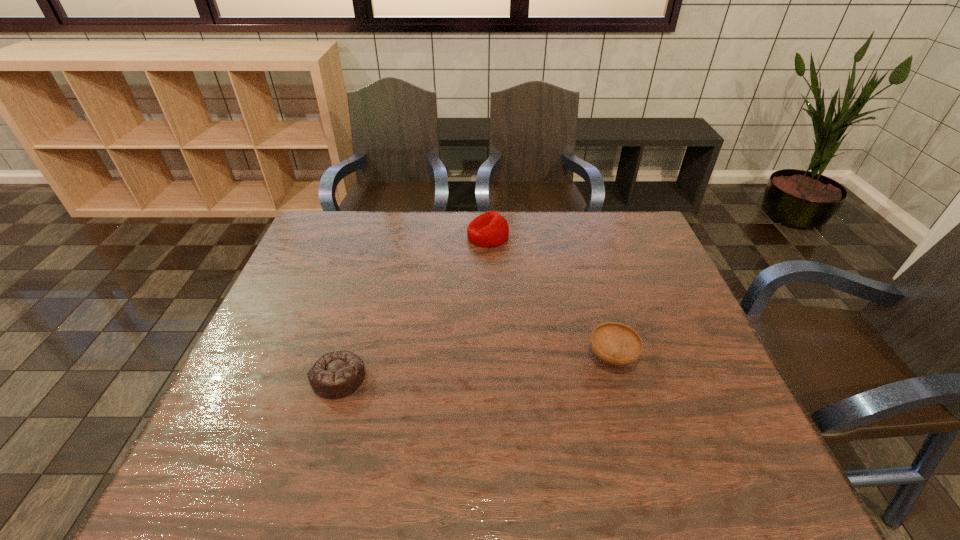
I want to click on free area in between the leftmost object and the rightmost object, so click(x=475, y=368).

You are a GUI agent. You are given a task and a screenshot of the screen. Output one action in this format:
    pyautogui.click(x=<x>, y=<y>)
    Task: Click on the vacant space that is in between the nearer beanbag and the rightmost object
    Image resolution: width=960 pixels, height=540 pixels.
    Given the screenshot: What is the action you would take?
    (x=475, y=368)

At what (x,y) coordinates should I click in order to perform the action: click on free space between the shorter beanbag and the rightmost object. Please return your answer as a coordinate pair (x, y). This screenshot has height=540, width=960. Looking at the image, I should click on (475, 368).

Find the location of a particular element. The height and width of the screenshot is (540, 960). vacant space in between the shorter beanbag and the bowl is located at coordinates (475, 368).

This screenshot has width=960, height=540. I want to click on vacant space in between the left beanbag and the bowl, so click(475, 368).

Identify the location of vacant area between the second object from left to right and the leftmost object. (414, 307).

Where is `object that stands as the second closest to the bowl`? The image size is (960, 540). object that stands as the second closest to the bowl is located at coordinates (337, 374).

Where is `the closest object to the farther beanbag`? Image resolution: width=960 pixels, height=540 pixels. the closest object to the farther beanbag is located at coordinates (617, 344).

Locate an element on the screen. free space in the image that satisfies the following two spatial constraints: 1. on the seat area of the farthest object; 2. on the left side of the bowl is located at coordinates (491, 357).

Where is `vacant position in the image that satisfies the following two spatial constraints: 1. on the seat area of the right beanbag; 2. on the right side of the rightmost object`? Image resolution: width=960 pixels, height=540 pixels. vacant position in the image that satisfies the following two spatial constraints: 1. on the seat area of the right beanbag; 2. on the right side of the rightmost object is located at coordinates (491, 357).